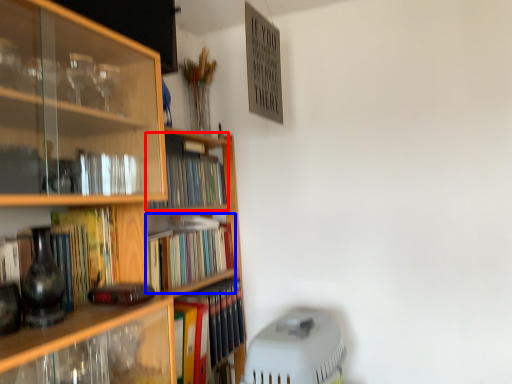
Question: Which object appears closest to the camera in this image, book (highlighted by a red box) or book (highlighted by a blue box)?

Choices:
 (A) book
 (B) book

Answer: (B)